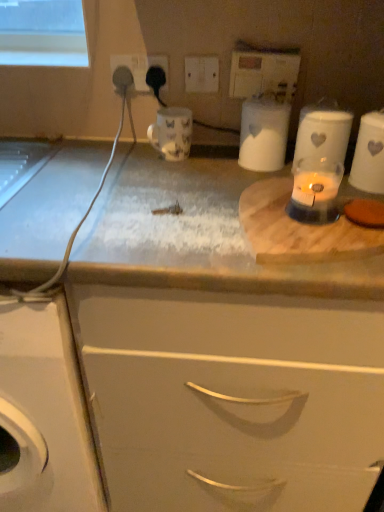
Question: Can you confirm if white plastic electric outlet at upper center, which is the fourth electric outlet in left-to-right order, is shorter than white ceramic jar at upper right, acting as the third appliance starting from the left?

Choices:
 (A) no
 (B) yes

Answer: (B)

Question: From the image's perspective, is white plastic electric outlet at upper center, marked as the 1th electric outlet in a right-to-left arrangement, under white ceramic jar at upper right, placed as the 1th appliance when sorted from right to left?

Choices:
 (A) no
 (B) yes

Answer: (A)

Question: Considering the relative sizes of white plastic electric outlet at upper center, which is the fourth electric outlet in left-to-right order, and white ceramic jar at upper right, placed as the 1th appliance when sorted from right to left, in the image provided, is white plastic electric outlet at upper center, which is the fourth electric outlet in left-to-right order, wider than white ceramic jar at upper right, placed as the 1th appliance when sorted from right to left,?

Choices:
 (A) yes
 (B) no

Answer: (B)

Question: From the image's perspective, is white plastic electric outlet at upper center, marked as the 1th electric outlet in a right-to-left arrangement, on top of white ceramic jar at upper right, acting as the third appliance starting from the left?

Choices:
 (A) no
 (B) yes

Answer: (B)

Question: From a real-world perspective, does white plastic electric outlet at upper center, which is the fourth electric outlet in left-to-right order, sit lower than white ceramic jar at upper right, placed as the 1th appliance when sorted from right to left?

Choices:
 (A) yes
 (B) no

Answer: (B)

Question: Would you say white plastic electric outlet at upper center, which is the fourth electric outlet in left-to-right order, contains white ceramic jar at upper right, acting as the third appliance starting from the left?

Choices:
 (A) no
 (B) yes

Answer: (A)

Question: Is white plastic switch at upper center, which is the second electric outlet from right to left, thinner than white ceramic jar at upper right, placed as the 1th appliance when sorted from right to left?

Choices:
 (A) no
 (B) yes

Answer: (B)

Question: Can you confirm if white plastic switch at upper center, which is the 3th electric outlet in left-to-right order, is smaller than white ceramic jar at upper right, acting as the third appliance starting from the left?

Choices:
 (A) no
 (B) yes

Answer: (B)

Question: Is there a large distance between white plastic switch at upper center, which is the 3th electric outlet in left-to-right order, and white ceramic jar at upper right, placed as the 1th appliance when sorted from right to left?

Choices:
 (A) yes
 (B) no

Answer: (B)

Question: Is white plastic switch at upper center, which is the second electric outlet from right to left, at the left side of white ceramic jar at upper right, acting as the third appliance starting from the left?

Choices:
 (A) no
 (B) yes

Answer: (B)

Question: Is white plastic switch at upper center, which is the 3th electric outlet in left-to-right order, positioned with its back to white ceramic jar at upper right, acting as the third appliance starting from the left?

Choices:
 (A) yes
 (B) no

Answer: (B)

Question: From a real-world perspective, is white plastic switch at upper center, which is the second electric outlet from right to left, beneath white ceramic jar at upper right, acting as the third appliance starting from the left?

Choices:
 (A) yes
 (B) no

Answer: (B)

Question: Does white matte cabinet at center lie behind white plastic switch at upper center, which is the second electric outlet from right to left?

Choices:
 (A) no
 (B) yes

Answer: (A)